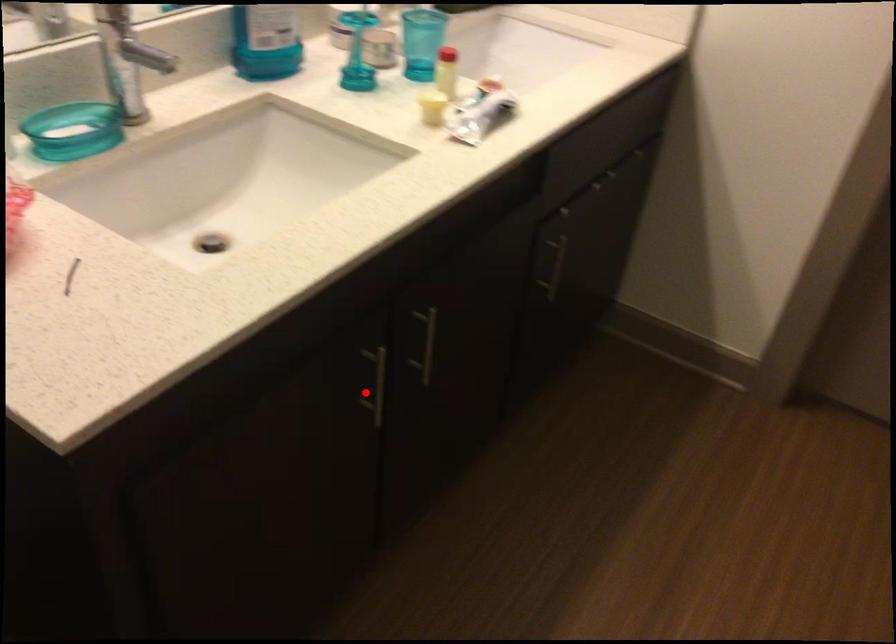
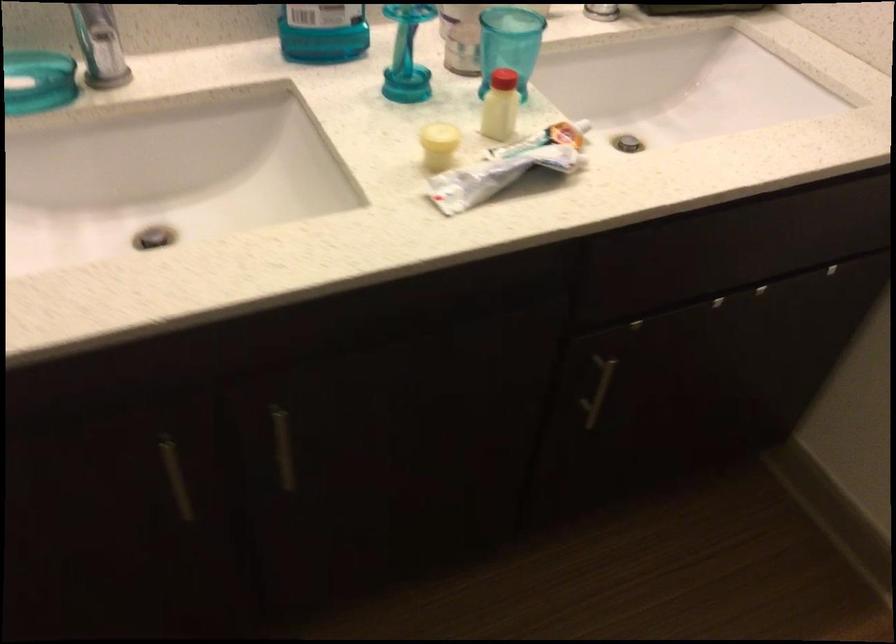
Find the pixel in the second image that matches the highlighted location in the first image.

(176, 477)